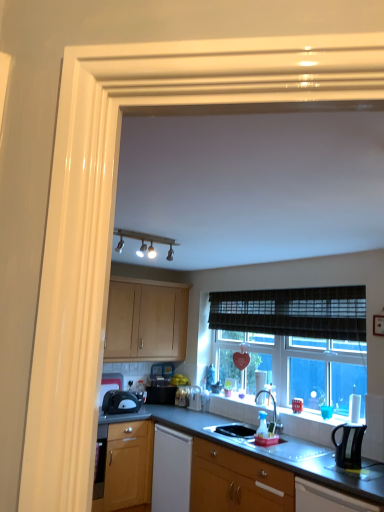
Question: Considering the positions of point 112,354 and point 375,508, is point 112,354 closer or farther from the camera than point 375,508?

Choices:
 (A) farther
 (B) closer

Answer: (A)

Question: From the image's perspective, is light wood cabinet at center, the 1th cabinetry positioned from the left, located above or below matte black toaster at lower right, which is the 1th cabinetry from front to back?

Choices:
 (A) above
 (B) below

Answer: (A)

Question: Which is nearer to the satin nickel faucet at center?

Choices:
 (A) wooden cabinet at lower center, the 1th cabinetry from the bottom
 (B) white glossy sink at lower center, the 1th sink from the front
 (C) matte black toaster at lower left, the 1th kitchen appliance when ordered from left to right
 (D) matte white track lights at upper center
 (E) light wood cabinet at center, the first cabinetry positioned from the back

Answer: (B)

Question: Which object is positioned farthest from the white glossy sink at lower center, the 2th sink from the back?

Choices:
 (A) matte black toaster at lower right, which is the second cabinetry from bottom to top
 (B) black plastic kettle at right, positioned as the 1th kitchen appliance in front-to-back order
 (C) black matte sink at center, marked as the second sink in a front-to-back arrangement
 (D) clear plastic bottle at center
 (E) matte black toaster at lower left, acting as the 2th kitchen appliance starting from the front

Answer: (E)